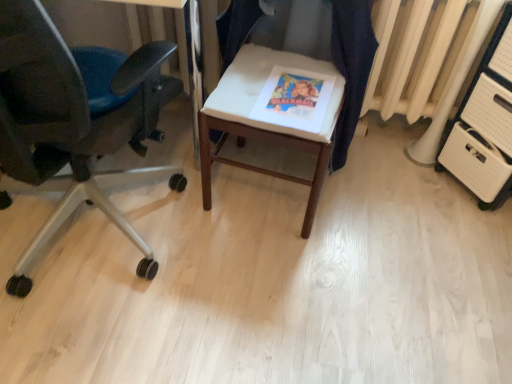
What is the approximate width of matte black office chair at left, the first chair viewed from the left?

The width of matte black office chair at left, the first chair viewed from the left, is 64.53 centimeters.

What do you see at coordinates (485, 125) in the screenshot?
I see `white plastic file cabinet at right` at bounding box center [485, 125].

The width and height of the screenshot is (512, 384). In order to click on white fabric chair at center in this screenshot , I will do `click(264, 122)`.

Measure the distance between point [215,134] and camera.

Point [215,134] is 5.50 feet away from camera.

What is the approximate height of matte paper magazine at center?

The height of matte paper magazine at center is 0.82 inches.

Identify the location of matte black office chair at left, marked as the second chair in a right-to-left arrangement. This screenshot has width=512, height=384. (73, 118).

Looking at this image, from a real-world perspective, who is located lower, white plastic file cabinet at right or matte black office chair at left, marked as the second chair in a right-to-left arrangement?

In real-world perspective, white plastic file cabinet at right is lower.

Are white plastic file cabinet at right and matte black office chair at left, marked as the second chair in a right-to-left arrangement, making contact?

No, white plastic file cabinet at right is not with matte black office chair at left, marked as the second chair in a right-to-left arrangement.

From the image's perspective, would you say white plastic file cabinet at right is shown under matte black office chair at left, the first chair viewed from the left?

No.

Is the position of white fabric cushion at center, which appears as the 2th chair when viewed from the left, less distant than that of white plastic file cabinet at right?

No, it is behind white plastic file cabinet at right.

Is point (350, 139) positioned after point (456, 164)?

No, (350, 139) is closer to viewer.

In terms of height, does white fabric cushion at center, which appears as the 2th chair when viewed from the left, look taller or shorter compared to white plastic file cabinet at right?

white fabric cushion at center, which appears as the 2th chair when viewed from the left, is shorter than white plastic file cabinet at right.

Is white fabric cushion at center, the first chair from the right, with white plastic file cabinet at right?

No, white fabric cushion at center, the first chair from the right, is not next to white plastic file cabinet at right.

From a real-world perspective, which object stands above the other?

matte black office chair at left, the first chair viewed from the left.

Is the surface of matte paper magazine at center in direct contact with matte black office chair at left, marked as the second chair in a right-to-left arrangement?

No.

Can matte black office chair at left, marked as the second chair in a right-to-left arrangement, be found inside matte paper magazine at center?

No, matte black office chair at left, marked as the second chair in a right-to-left arrangement, is not a part of matte paper magazine at center.

Which object is wider, matte paper magazine at center or matte black office chair at left, marked as the second chair in a right-to-left arrangement?

matte black office chair at left, marked as the second chair in a right-to-left arrangement, is wider.

Which object is positioned more to the left, white fabric chair at center or matte paper magazine at center?

white fabric chair at center is more to the left.

Are white fabric chair at center and matte paper magazine at center far apart?

They are positioned close to each other.

Which is in front, white fabric chair at center or matte paper magazine at center?

white fabric chair at center.

Based on the photo, from the image's perspective, between white fabric chair at center and matte paper magazine at center, who is located below?

matte paper magazine at center is shown below in the image.

Are white fabric cushion at center, the first chair from the right, and matte paper magazine at center far apart?

white fabric cushion at center, the first chair from the right, is actually quite close to matte paper magazine at center.

Can you confirm if white fabric cushion at center, the first chair from the right, is taller than matte paper magazine at center?

Correct, white fabric cushion at center, the first chair from the right, is much taller as matte paper magazine at center.

Which object is thinner, white plastic file cabinet at right or white fabric chair at center?

With smaller width is white plastic file cabinet at right.

How far apart are white plastic file cabinet at right and white fabric chair at center?

They are 26.93 inches apart.

Between white plastic file cabinet at right and white fabric chair at center, which one has larger size?

white fabric chair at center.

From the image's perspective, which object appears higher, white plastic file cabinet at right or white fabric chair at center?

white plastic file cabinet at right.

Does white fabric chair at center turn towards white fabric cushion at center, which appears as the 2th chair when viewed from the left?

Yes, white fabric chair at center faces towards white fabric cushion at center, which appears as the 2th chair when viewed from the left.

Do you think white fabric chair at center is within white fabric cushion at center, the first chair from the right, or outside of it?

white fabric chair at center is spatially positioned inside white fabric cushion at center, the first chair from the right.

Which object is further away from the camera, white fabric chair at center or white fabric cushion at center, which appears as the 2th chair when viewed from the left?

white fabric cushion at center, which appears as the 2th chair when viewed from the left, is more distant.

Which of these two, white fabric chair at center or white fabric cushion at center, the first chair from the right, is smaller?

Smaller between the two is white fabric cushion at center, the first chair from the right.

Which chair is the 2nd one when counting from the left side of the white plastic file cabinet at right? Please provide its 2D coordinates.

[(73, 118)]

I want to click on file cabinet in front of the white fabric cushion at center, the first chair from the right, so click(x=485, y=125).

Estimate the real-world distances between objects in this image. Which object is closer to white plastic file cabinet at right, matte black office chair at left, marked as the second chair in a right-to-left arrangement, or matte paper magazine at center?

matte paper magazine at center lies closer to white plastic file cabinet at right than the other object.

Considering their positions, is matte paper magazine at center positioned closer to matte black office chair at left, marked as the second chair in a right-to-left arrangement, than white plastic file cabinet at right?

The object closer to matte black office chair at left, marked as the second chair in a right-to-left arrangement, is matte paper magazine at center.

From the image, which object appears to be nearer to white plastic file cabinet at right, matte black office chair at left, marked as the second chair in a right-to-left arrangement, or white fabric cushion at center, the first chair from the right?

white fabric cushion at center, the first chair from the right, lies closer to white plastic file cabinet at right than the other object.

Which object lies further to the anchor point white fabric chair at center, white fabric cushion at center, which appears as the 2th chair when viewed from the left, or matte paper magazine at center?

white fabric cushion at center, which appears as the 2th chair when viewed from the left, lies further to white fabric chair at center than the other object.

Estimate the real-world distances between objects in this image. Which object is further from white fabric chair at center, white plastic file cabinet at right or matte black office chair at left, the first chair viewed from the left?

The object further to white fabric chair at center is white plastic file cabinet at right.

Considering their positions, is matte black office chair at left, marked as the second chair in a right-to-left arrangement, positioned further to white fabric chair at center than white fabric cushion at center, the first chair from the right?

matte black office chair at left, marked as the second chair in a right-to-left arrangement, lies further to white fabric chair at center than the other object.

Looking at the image, which one is located closer to white fabric chair at center, matte black office chair at left, the first chair viewed from the left, or matte paper magazine at center?

matte paper magazine at center is positioned closer to the anchor white fabric chair at center.

Based on their spatial positions, is matte black office chair at left, the first chair viewed from the left, or white fabric chair at center closer to white fabric cushion at center, the first chair from the right?

white fabric chair at center lies closer to white fabric cushion at center, the first chair from the right, than the other object.

Find the location of a particular element. The image size is (512, 384). magazine situated between matte black office chair at left, the first chair viewed from the left, and white fabric cushion at center, the first chair from the right, from left to right is located at coordinates (294, 99).

Locate an element on the screen. desk situated between matte black office chair at left, the first chair viewed from the left, and white fabric cushion at center, the first chair from the right, from left to right is located at coordinates (264, 122).

Where is `magazine between white fabric chair at center and white plastic file cabinet at right from left to right`? This screenshot has width=512, height=384. magazine between white fabric chair at center and white plastic file cabinet at right from left to right is located at coordinates (294, 99).

Where is `chair located between matte paper magazine at center and white plastic file cabinet at right in the left-right direction`? The height and width of the screenshot is (384, 512). chair located between matte paper magazine at center and white plastic file cabinet at right in the left-right direction is located at coordinates (351, 66).